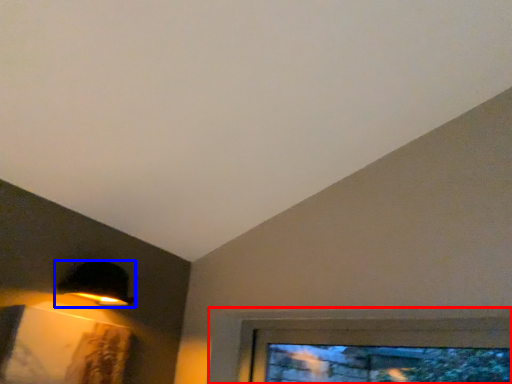
Question: Which object is closer to the camera taking this photo, window (highlighted by a red box) or lamp (highlighted by a blue box)?

Choices:
 (A) window
 (B) lamp

Answer: (A)